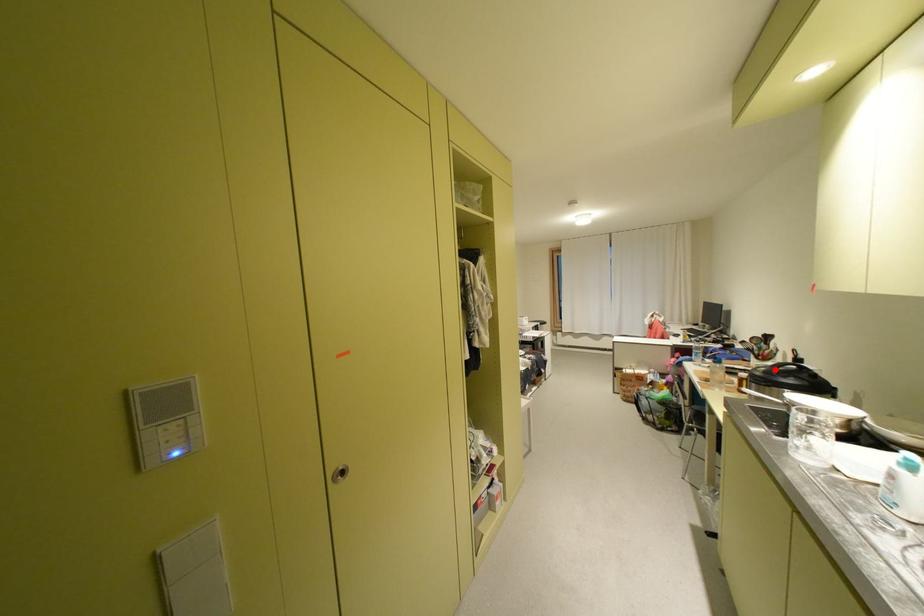
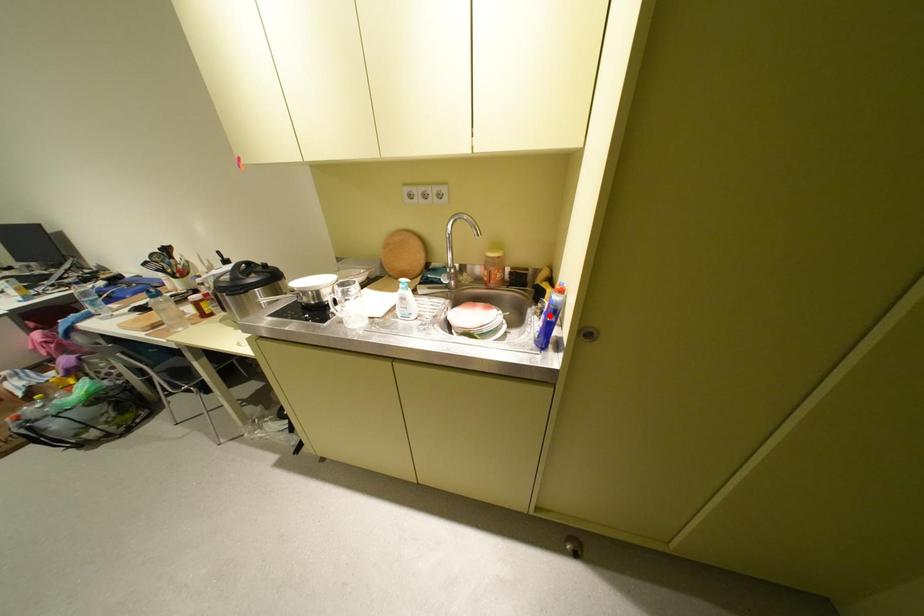
I am providing you with two images of the same scene from different viewpoints. A red point is marked on the first image and another point is marked on the second image. Is the red point in image1 aligned with the point shown in image2?

No